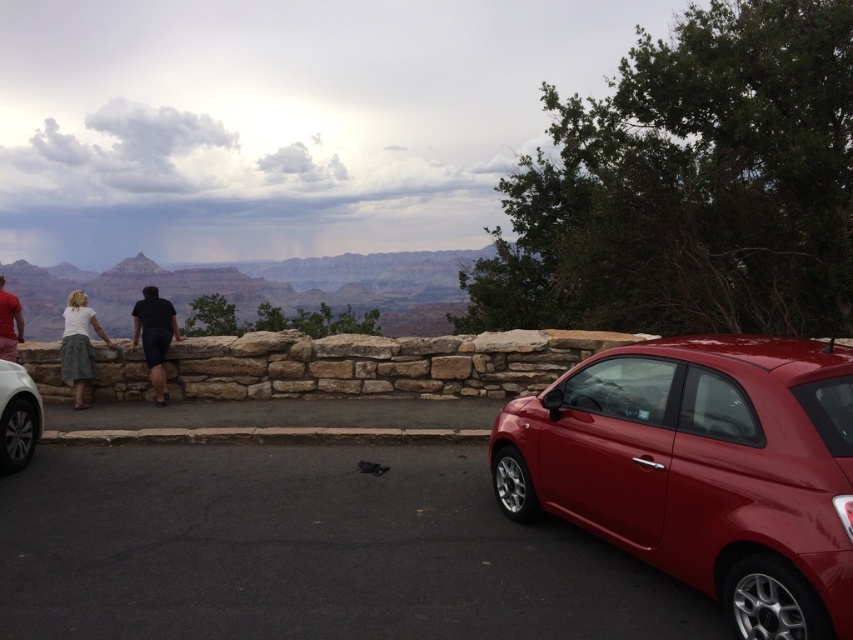
Is white glossy car at lower left bigger than black matte shorts at center?

No, white glossy car at lower left is not bigger than black matte shorts at center.

Is point (7, 449) positioned in front of point (177, 332)?

Yes, point (7, 449) is closer to viewer.

Find the location of a particular element. The height and width of the screenshot is (640, 853). white glossy car at lower left is located at coordinates pyautogui.click(x=16, y=417).

Does white glossy car at lower left appear over matte red shirt at left?

Incorrect, white glossy car at lower left is not positioned above matte red shirt at left.

Where is `white glossy car at lower left`? This screenshot has height=640, width=853. white glossy car at lower left is located at coordinates (16, 417).

Is black asphalt parking lot at lower right above glossy red car at lower right?

Actually, black asphalt parking lot at lower right is below glossy red car at lower right.

Who is positioned more to the right, black asphalt parking lot at lower right or glossy red car at lower right?

glossy red car at lower right

Identify the location of black asphalt parking lot at lower right. Image resolution: width=853 pixels, height=640 pixels. (x=306, y=552).